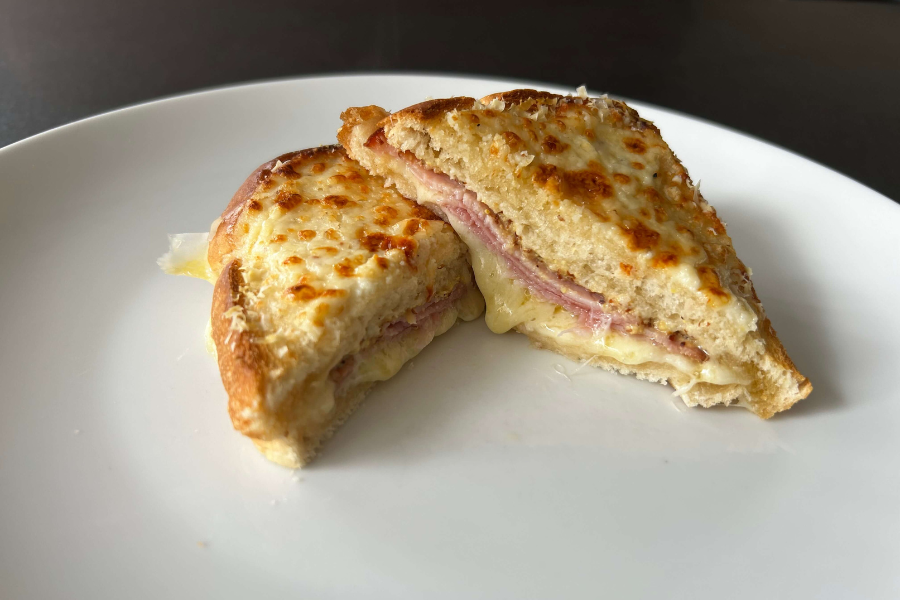
Locate an element on the screen. This screenshot has height=600, width=900. plate is located at coordinates (245, 505).